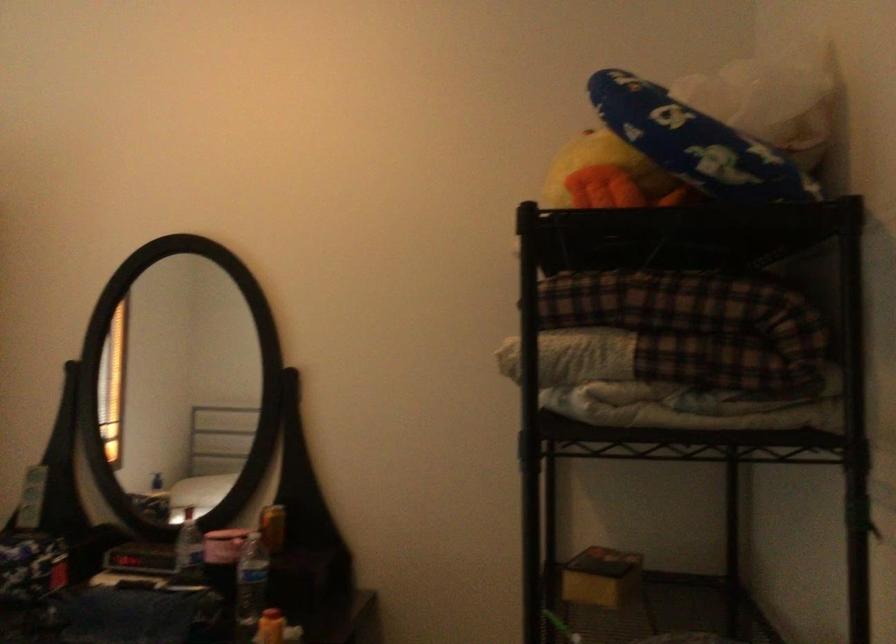
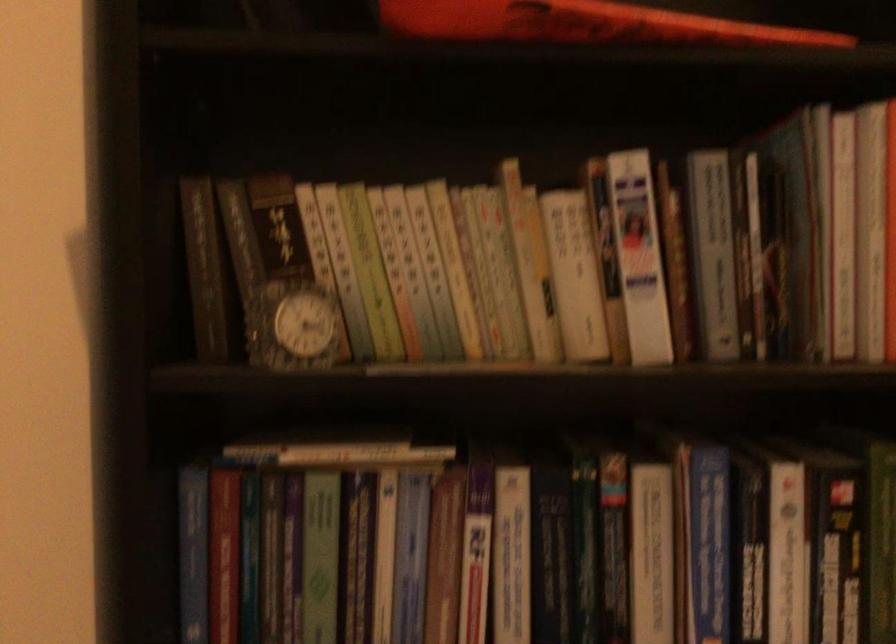
In a continuous first-person perspective shot, in which direction is the camera moving?

The movement direction of the cameraman is left, forward.